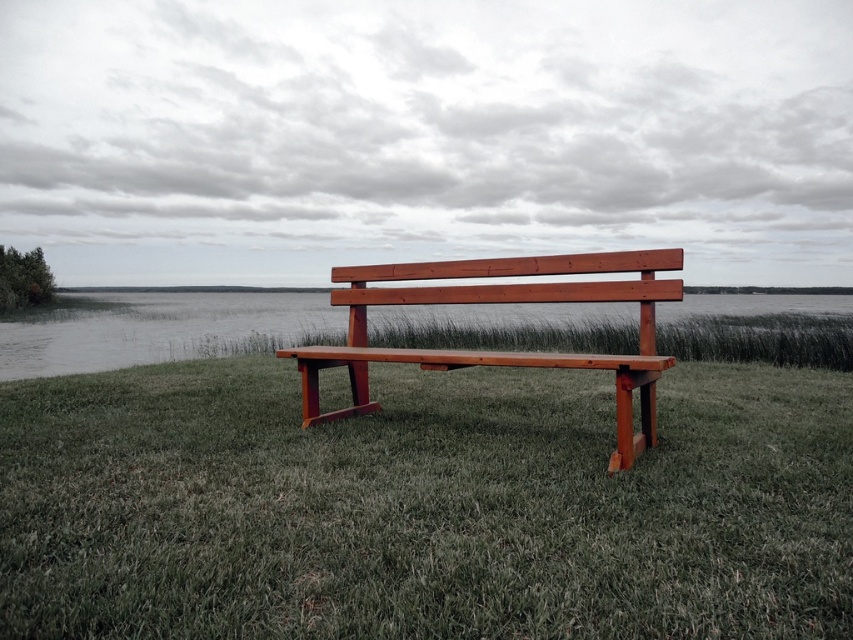
You are planning to place a small garden gnome between the green grass at center and the wooden bench at center. How much space will be between the gnome and each object?

The green grass at center and wooden bench at center are 6.03 feet apart. If the gnome is placed exactly in the middle, it will be 3.015 feet away from both the green grass at center and the wooden bench at center.

You are planning to sit on the wooden bench at center to enjoy the view of the water. However, you notice the green grass at center nearby. Is the grass shorter than the bench?

The green grass at center is not as tall as wooden bench at center, so yes, the grass is shorter than the bench.